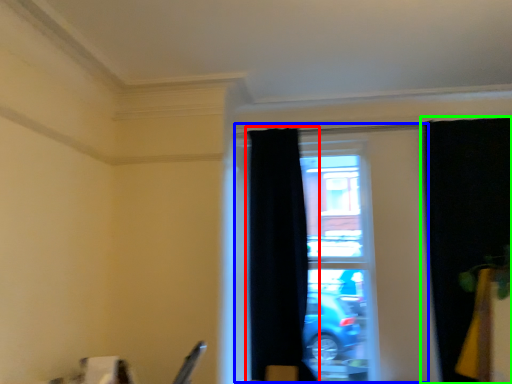
Question: Estimate the real-world distances between objects in this image. Which object is farther from curtain (highlighted by a red box), window (highlighted by a blue box) or curtain (highlighted by a green box)?

Choices:
 (A) window
 (B) curtain

Answer: (B)